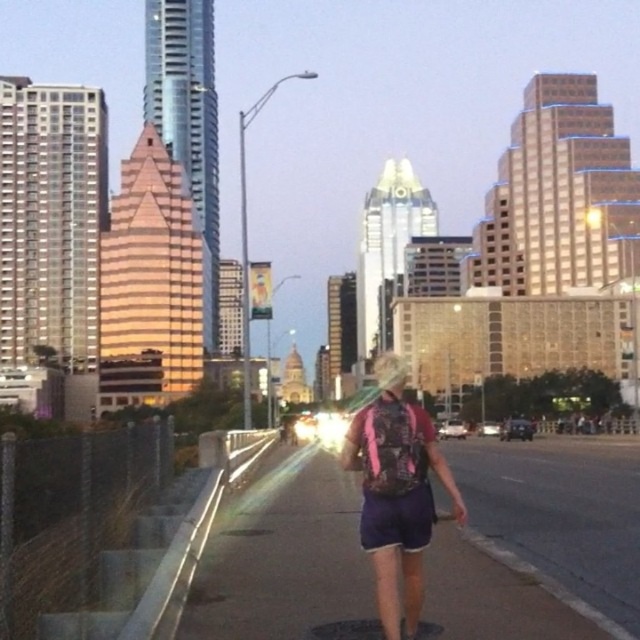
Question: Does purple fabric pavement at center have a larger size compared to pink fabric shorts at center?

Choices:
 (A) no
 (B) yes

Answer: (B)

Question: Which point is closer to the camera?

Choices:
 (A) (388, 396)
 (B) (452, 608)

Answer: (A)

Question: Among these points, which one is farthest from the camera?

Choices:
 (A) (376, 540)
 (B) (522, 628)

Answer: (B)

Question: Does purple fabric pavement at center appear over pink fabric shorts at center?

Choices:
 (A) yes
 (B) no

Answer: (B)

Question: Which point is farther to the camera?

Choices:
 (A) pink fabric shorts at center
 (B) purple fabric pavement at center

Answer: (B)

Question: Is purple fabric pavement at center positioned behind pink fabric shorts at center?

Choices:
 (A) no
 (B) yes

Answer: (B)